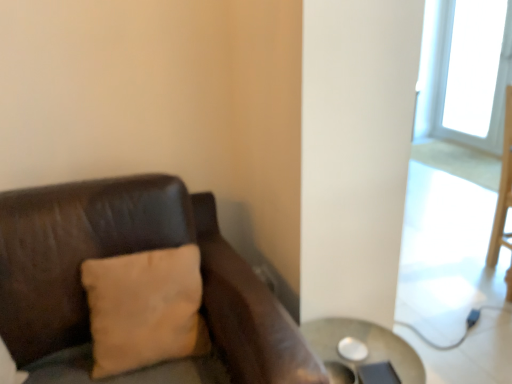
What do you see at coordinates (366, 344) in the screenshot?
I see `metallic silver table at lower right` at bounding box center [366, 344].

At what (x,y) coordinates should I click in order to perform the action: click on metallic silver table at lower right. Please return your answer as a coordinate pair (x, y). Looking at the image, I should click on (366, 344).

This screenshot has width=512, height=384. What do you see at coordinates (145, 309) in the screenshot?
I see `beige fabric pillow at left` at bounding box center [145, 309].

Measure the distance between point [106,330] and camera.

Point [106,330] and camera are 1.23 meters apart.

This screenshot has width=512, height=384. Find the location of `beige fabric pillow at left`. beige fabric pillow at left is located at coordinates (145, 309).

Where is `metallic silver table at lower right`? The image size is (512, 384). metallic silver table at lower right is located at coordinates (366, 344).

Which is more to the right, metallic silver table at lower right or beige fabric pillow at left?

metallic silver table at lower right is more to the right.

Does metallic silver table at lower right lie in front of beige fabric pillow at left?

No, metallic silver table at lower right is behind beige fabric pillow at left.

Does point (376, 361) lie in front of point (183, 340)?

No, it is behind (183, 340).

From the image's perspective, does metallic silver table at lower right appear lower than beige fabric pillow at left?

Indeed, from the image's perspective, metallic silver table at lower right is shown beneath beige fabric pillow at left.

From a real-world perspective, is metallic silver table at lower right positioned over beige fabric pillow at left based on gravity?

No, from a real-world perspective, metallic silver table at lower right is not on top of beige fabric pillow at left.

Considering the sizes of objects metallic silver table at lower right and beige fabric pillow at left in the image provided, who is wider, metallic silver table at lower right or beige fabric pillow at left?

metallic silver table at lower right is wider.

Can you confirm if metallic silver table at lower right is shorter than beige fabric pillow at left?

Yes, metallic silver table at lower right is shorter than beige fabric pillow at left.

Who is bigger, metallic silver table at lower right or beige fabric pillow at left?

metallic silver table at lower right is bigger.

Is beige fabric pillow at left located within metallic silver table at lower right?

That's incorrect, beige fabric pillow at left is not inside metallic silver table at lower right.

Are metallic silver table at lower right and beige fabric pillow at left beside each other?

No, metallic silver table at lower right is not with beige fabric pillow at left.

Is metallic silver table at lower right looking in the opposite direction of beige fabric pillow at left?

Result: No.

What's the angular difference between metallic silver table at lower right and beige fabric pillow at left's facing directions?

1.37 degrees.

The height and width of the screenshot is (384, 512). Find the location of `pillow above the metallic silver table at lower right (from the image's perspective)`. pillow above the metallic silver table at lower right (from the image's perspective) is located at coordinates (145, 309).

Considering the positions of objects beige fabric pillow at left and metallic silver table at lower right in the image provided, who is more to the left, beige fabric pillow at left or metallic silver table at lower right?

Positioned to the left is beige fabric pillow at left.

Does beige fabric pillow at left lie in front of metallic silver table at lower right?

Yes, it is in front of metallic silver table at lower right.

Does point (108, 333) come in front of point (419, 364)?

That is True.

From the image's perspective, is beige fabric pillow at left over metallic silver table at lower right?

Yes, from the image's perspective, beige fabric pillow at left is on top of metallic silver table at lower right.

From a real-world perspective, which object stands above the other?

beige fabric pillow at left.

Looking at their sizes, would you say beige fabric pillow at left is wider or thinner than metallic silver table at lower right?

Clearly, beige fabric pillow at left has less width compared to metallic silver table at lower right.

Which of these two, beige fabric pillow at left or metallic silver table at lower right, stands taller?

beige fabric pillow at left is taller.

Does beige fabric pillow at left have a larger size compared to metallic silver table at lower right?

Actually, beige fabric pillow at left might be smaller than metallic silver table at lower right.

Which is correct: beige fabric pillow at left is inside metallic silver table at lower right, or outside of it?

The correct answer is: outside.

Are beige fabric pillow at left and metallic silver table at lower right located far from each other?

No, beige fabric pillow at left is not far from metallic silver table at lower right.

From the picture: Is beige fabric pillow at left looking in the opposite direction of metallic silver table at lower right?

No.

The height and width of the screenshot is (384, 512). In order to click on pillow above the metallic silver table at lower right (from a real-world perspective) in this screenshot , I will do `click(145, 309)`.

This screenshot has width=512, height=384. I want to click on pillow positioned vertically above the metallic silver table at lower right (from a real-world perspective), so click(145, 309).

The width and height of the screenshot is (512, 384). Identify the location of table directly beneath the beige fabric pillow at left (from a real-world perspective). (366, 344).